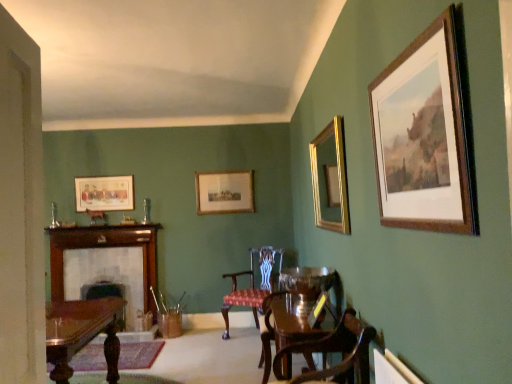
Question: In which direction should I rotate to look at wooden polished chair at center, which is the 2th chair in back-to-front order?

Choices:
 (A) left
 (B) right

Answer: (B)

Question: Which direction should I rotate to look at velvet upholstered chair at center, which is the 1th chair in back-to-front order, — up or down?

Choices:
 (A) down
 (B) up

Answer: (A)

Question: Is wooden polished chair at lower right, the 3th chair in the back-to-front sequence, taller than wooden fireplace at left?

Choices:
 (A) no
 (B) yes

Answer: (A)

Question: Is the depth of wooden polished chair at lower right, the first chair in the front-to-back sequence, greater than that of wooden fireplace at left?

Choices:
 (A) yes
 (B) no

Answer: (B)

Question: From a real-world perspective, is wooden polished chair at lower right, the first chair in the front-to-back sequence, over wooden fireplace at left?

Choices:
 (A) no
 (B) yes

Answer: (B)

Question: From the image's perspective, is wooden polished chair at lower right, the 3th chair in the back-to-front sequence, on top of wooden fireplace at left?

Choices:
 (A) yes
 (B) no

Answer: (A)

Question: Is wooden polished chair at lower right, the 3th chair in the back-to-front sequence, shorter than wooden fireplace at left?

Choices:
 (A) no
 (B) yes

Answer: (B)

Question: Can you confirm if wooden polished chair at lower right, the first chair in the front-to-back sequence, is thinner than wooden fireplace at left?

Choices:
 (A) yes
 (B) no

Answer: (B)

Question: Is wooden picture frame at center, acting as the 1th picture frame starting from the back, smaller than wooden polished chair at lower right, the 3th chair in the back-to-front sequence?

Choices:
 (A) no
 (B) yes

Answer: (B)

Question: Is wooden picture frame at center, which is counted as the fourth picture frame, starting from the front, located outside wooden polished chair at lower right, the 3th chair in the back-to-front sequence?

Choices:
 (A) no
 (B) yes

Answer: (B)

Question: Can you confirm if wooden picture frame at center, acting as the 1th picture frame starting from the back, is taller than wooden polished chair at lower right, the 3th chair in the back-to-front sequence?

Choices:
 (A) no
 (B) yes

Answer: (B)

Question: Is wooden picture frame at center, the 2th picture frame from the left, oriented away from wooden polished chair at lower right, the 3th chair in the back-to-front sequence?

Choices:
 (A) no
 (B) yes

Answer: (A)

Question: From the image's perspective, would you say wooden picture frame at center, acting as the 1th picture frame starting from the back, is shown under wooden polished chair at lower right, the first chair in the front-to-back sequence?

Choices:
 (A) no
 (B) yes

Answer: (A)

Question: From a real-world perspective, is wooden picture frame at center, the 3th picture frame from the right, located higher than wooden polished chair at lower right, the 3th chair in the back-to-front sequence?

Choices:
 (A) yes
 (B) no

Answer: (A)

Question: Can matte wooden picture frame at upper left, which is the 4th picture frame in right-to-left order, be found inside wooden fireplace at left?

Choices:
 (A) yes
 (B) no

Answer: (B)